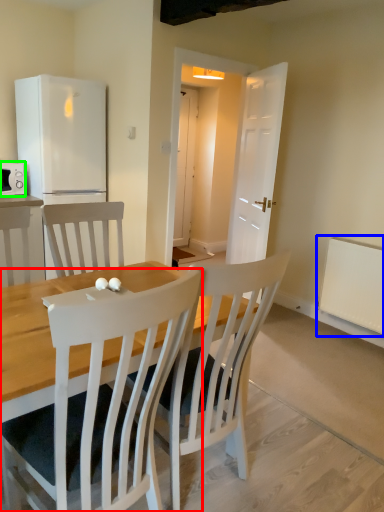
Question: Which is farther away from chair (highlighted by a red box)? radiator (highlighted by a blue box) or microwave oven (highlighted by a green box)?

Choices:
 (A) radiator
 (B) microwave oven

Answer: (B)